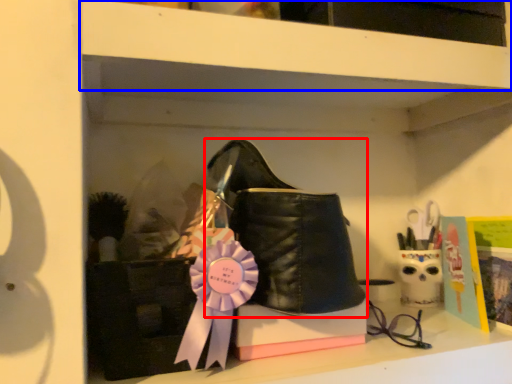
Question: Which object appears farthest to the camera in this image, footwear (highlighted by a red box) or shelf (highlighted by a blue box)?

Choices:
 (A) footwear
 (B) shelf

Answer: (A)